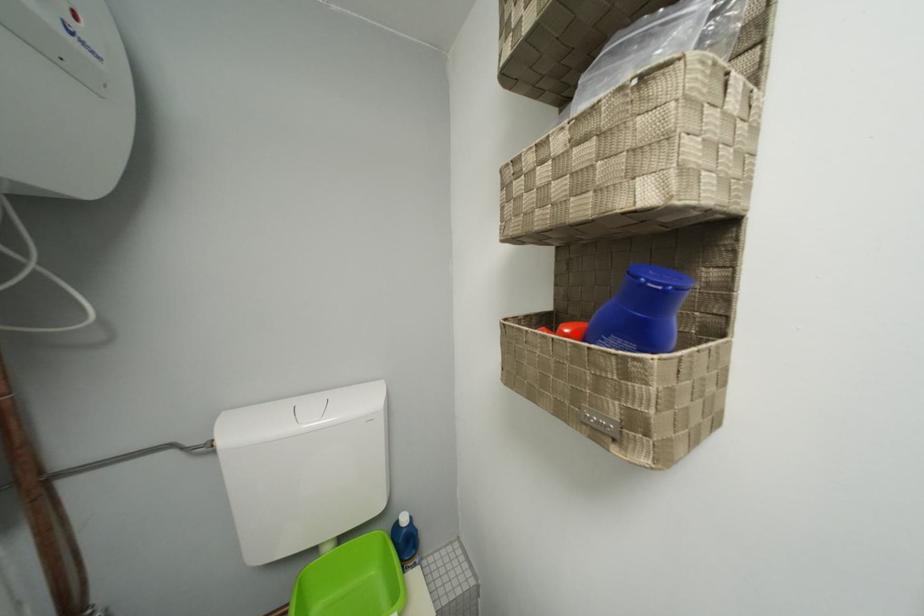
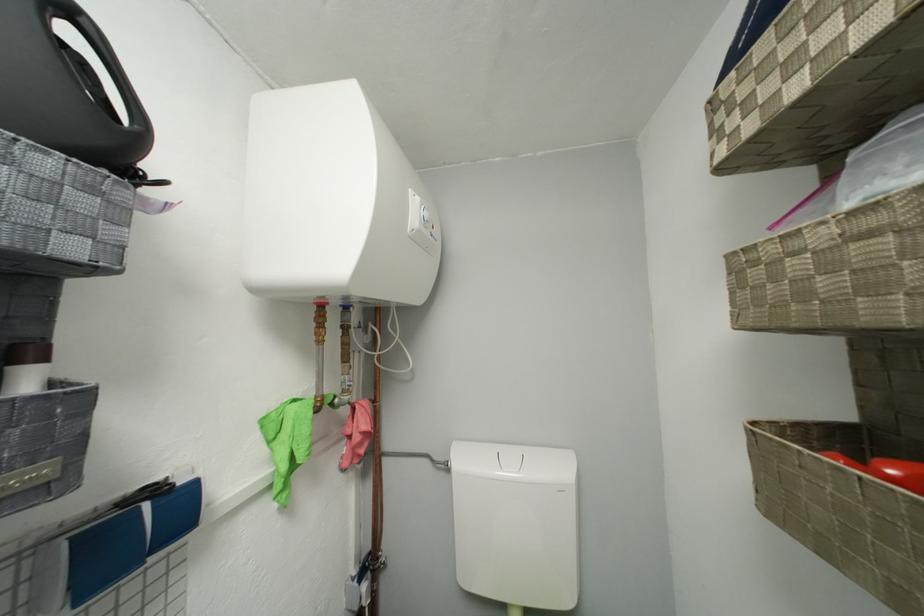
Find the pixel in the second image that matches the highlighted location in the first image.

(903, 475)